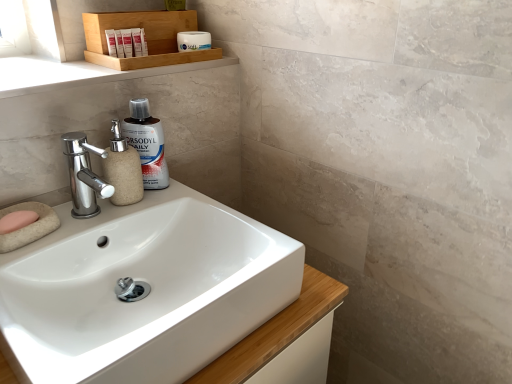
This screenshot has width=512, height=384. Find the location of `vacant space in front of white matte jar at upper center, which is the first toiletry in right-to-left order`. vacant space in front of white matte jar at upper center, which is the first toiletry in right-to-left order is located at coordinates (158, 66).